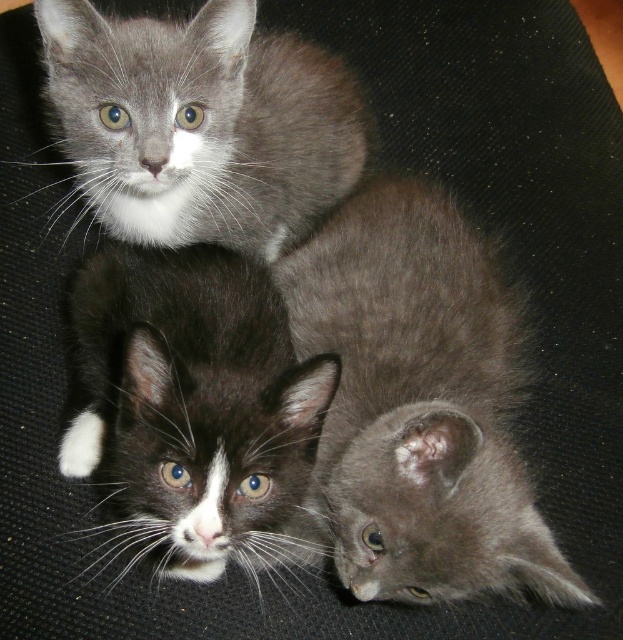
Does black and white fur cat at center appear over gray fluffy kitten at upper left?

Actually, black and white fur cat at center is below gray fluffy kitten at upper left.

Can you confirm if black and white fur cat at center is taller than gray fluffy kitten at upper left?

Yes, black and white fur cat at center is taller than gray fluffy kitten at upper left.

Does point (183, 500) lie behind point (250, 237)?

No, (183, 500) is closer to viewer.

Image resolution: width=623 pixels, height=640 pixels. I want to click on black and white fur cat at center, so (x=189, y=403).

Does gray fluffy kitten at center have a lesser width compared to gray fluffy kitten at upper left?

Yes, gray fluffy kitten at center is thinner than gray fluffy kitten at upper left.

Does point (361, 244) come closer to viewer compared to point (255, 1)?

No, (361, 244) is further to viewer.

I want to click on gray fluffy kitten at center, so click(416, 406).

Can you confirm if gray fluffy kitten at center is smaller than black and white fur cat at center?

No, gray fluffy kitten at center is not smaller than black and white fur cat at center.

Does gray fluffy kitten at center appear over black and white fur cat at center?

Yes.

Is point (353, 307) positioned behind point (302, 401)?

Yes.

The image size is (623, 640). I want to click on gray fluffy kitten at center, so click(x=416, y=406).